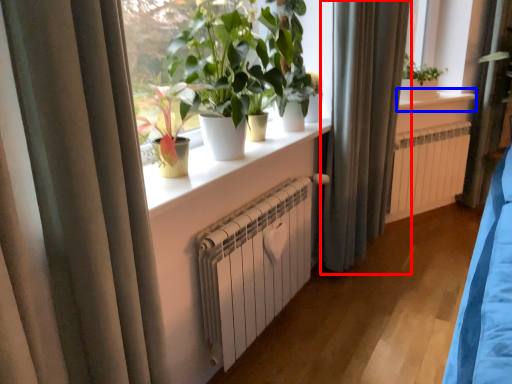
Question: Which of the following is the farthest to the observer, curtain (highlighted by a red box) or window sill (highlighted by a blue box)?

Choices:
 (A) curtain
 (B) window sill

Answer: (B)